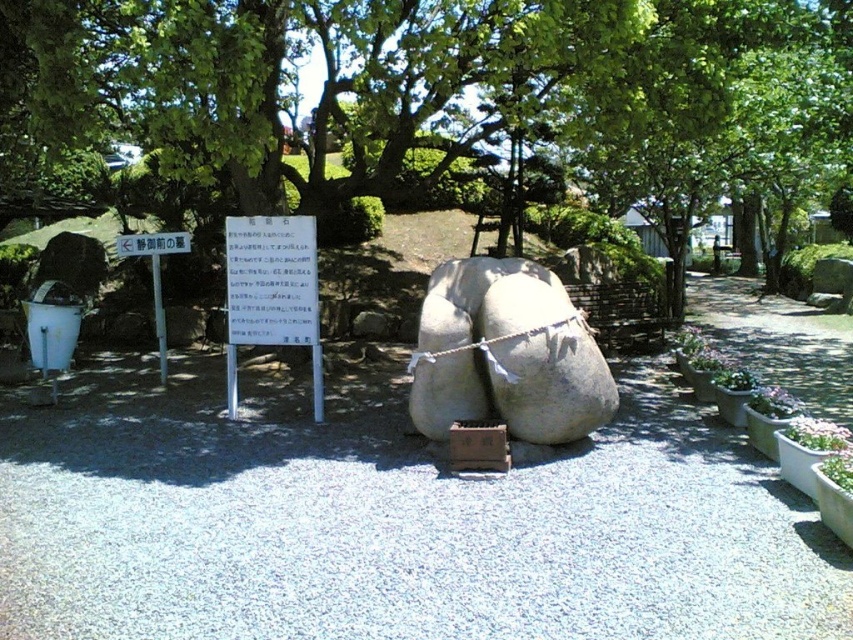
Does white paper sign at center appear over white paper sign at upper center?

Actually, white paper sign at center is below white paper sign at upper center.

Does white paper sign at center appear on the left side of white paper sign at upper center?

No, white paper sign at center is not to the left of white paper sign at upper center.

Does point (254, 276) come farther from viewer compared to point (180, 234)?

No, (254, 276) is closer to viewer.

The width and height of the screenshot is (853, 640). I want to click on white paper sign at center, so click(x=271, y=292).